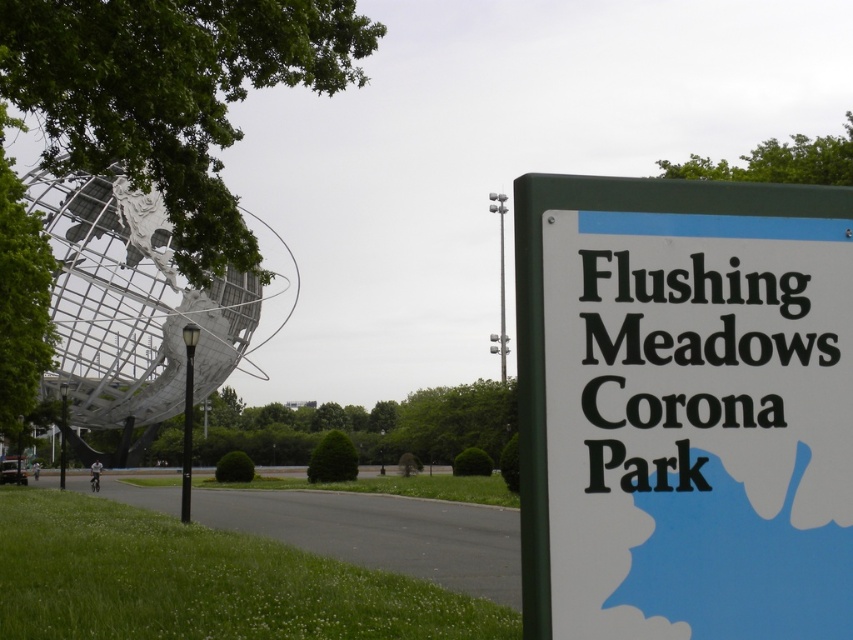
You are standing at the center of the grassy area in Flushing Meadows Corona Park and want to find the white plastic sign at right. Which direction should you walk to reach it?

Since the white plastic sign at right is located at point (683, 408), you should walk towards the right side of the image to reach it.

Based on the photo, you are standing at the center of the paved pathway in Flushing Meadows Corona Park. You see the white plastic sign at right and the metallic globe at left. Which object is positioned lower in the image?

The white plastic sign at right is located below the metallic globe at left, so it is positioned lower in the image.

You are standing in Flushing Meadows Corona Park and want to read the text on the white plastic sign at right. Can you reach it without moving closer?

The white plastic sign at right is 2.41 meters away from the viewer, so you can reach it without moving closer if your arm can extend that far. However, typically, an average person cannot reach 2.41 meters with their arm, so you might need to move closer to read it clearly.